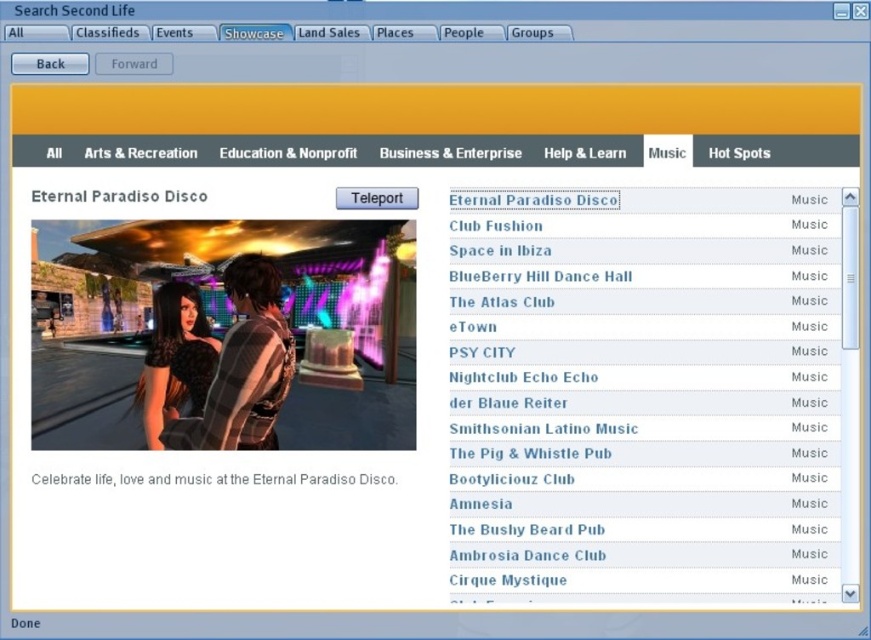
You are an avatar in Second Life trying to locate the shiny black dress at center and the white text on black background at center on the Eternal Paradiso Disco showcase page. Which object appears taller?

→ The shiny black dress at center has a greater height compared to the white text on black background at center, so the shiny black dress at center appears taller.

You are a new user in Second Life trying to find the disco location. You see the shiny black dress at center and the white text on black background at center. Which one is positioned higher in the Eternal Paradiso Disco section?

The shiny black dress at center is located above the white text on black background at center.

You are an avatar in Second Life trying to locate your outfit for the Eternal Paradiso Disco event. You remember that your shiny black dress at center is displayed in the showcase section. Where exactly is it located in the interface?

The shiny black dress at center is located at point coordinates of [220,337] in the showcase section.